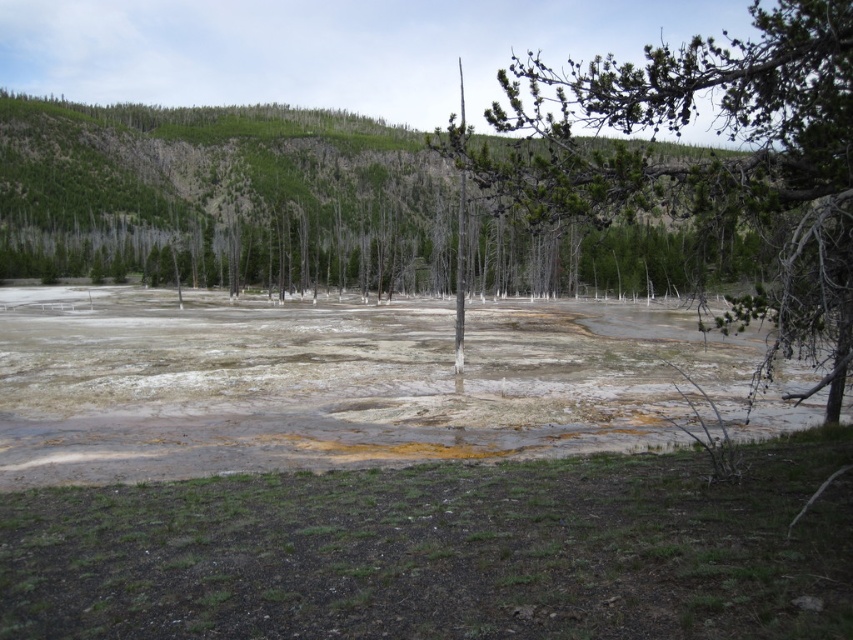
You are a geologist examining the geothermal area. You notice the yellowish sedimentary water at center and the green leafy tree at center. Which object occupies a smaller area in the scene?

The yellowish sedimentary water at center has a lesser width compared to the green leafy tree at center, so the yellowish sedimentary water at center occupies a smaller area in the scene.

You are a geologist studying the thermal pool in the image. You need to collect a sample of the yellowish sedimentary water at center. Based on the coordinates provided, where should you aim your sampling tool?

You should aim your sampling tool at point (344, 384) to collect the yellowish sedimentary water at center.

You are standing in the geothermal area and want to take a photo of the green leafy tree at center. However, the green forested hillside at upper center is blocking your view. Can you move to the right to get a clear shot?

The green leafy tree at center is behind the green forested hillside at upper center, so moving to the right might not help as the hillside is still in front of the tree. You might need to find a higher vantage point to see over the hillside.